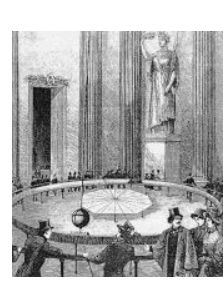
You are a GUI agent. You are given a task and a screenshot of the screen. Output one action in this format:
    pyautogui.click(x=<x>, y=<y>)
    Task: Click on the columns
    This screenshot has height=303, width=223.
    Given the screenshot: What is the action you would take?
    pyautogui.click(x=95, y=104), pyautogui.click(x=128, y=122), pyautogui.click(x=207, y=96), pyautogui.click(x=202, y=130), pyautogui.click(x=128, y=53), pyautogui.click(x=94, y=61)